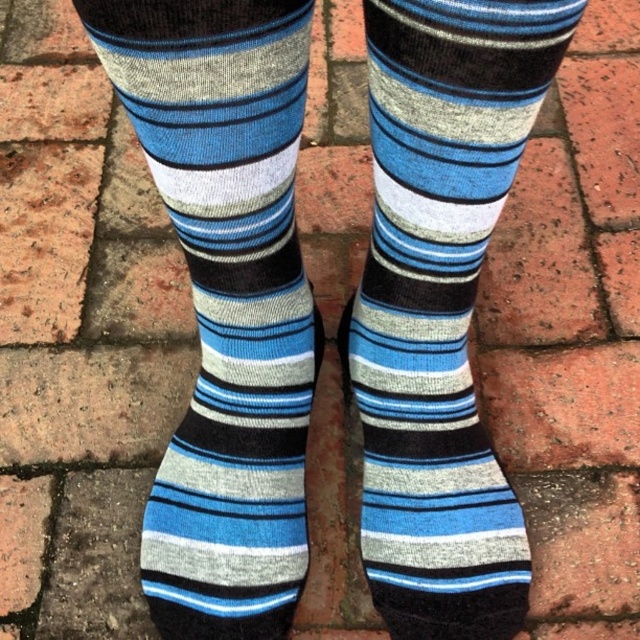
Can you confirm if blue striped sock at left is smaller than blue striped sock at center?

Yes, blue striped sock at left is smaller than blue striped sock at center.

At what (x,y) coordinates should I click in order to perform the action: click on blue striped sock at left. Please return your answer as a coordinate pair (x, y). Looking at the image, I should click on (225, 300).

Between point (216, 106) and point (496, 42), which one is positioned behind?

Point (216, 106)

At what (x,y) coordinates should I click in order to perform the action: click on blue striped sock at left. Please return your answer as a coordinate pair (x, y). Image resolution: width=640 pixels, height=640 pixels. Looking at the image, I should click on (225, 300).